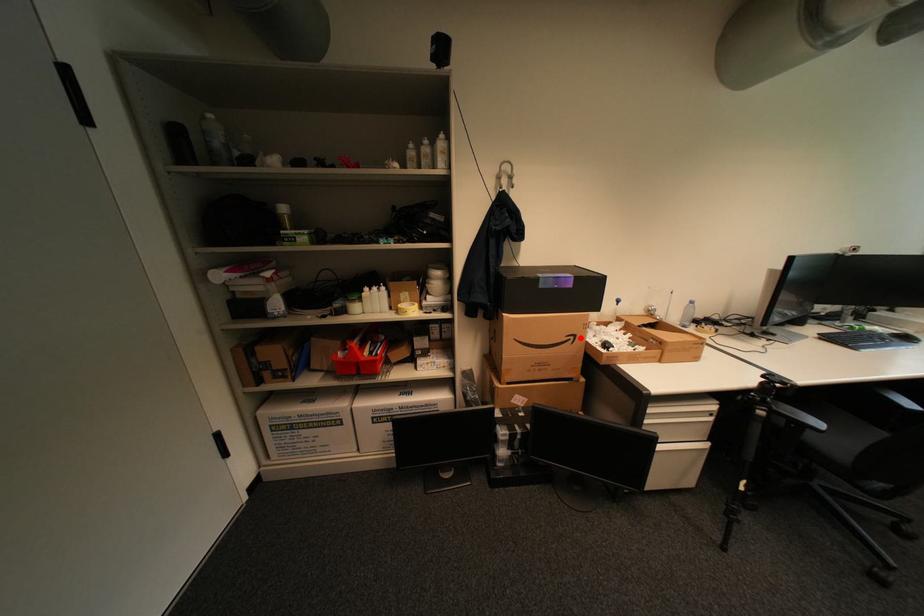
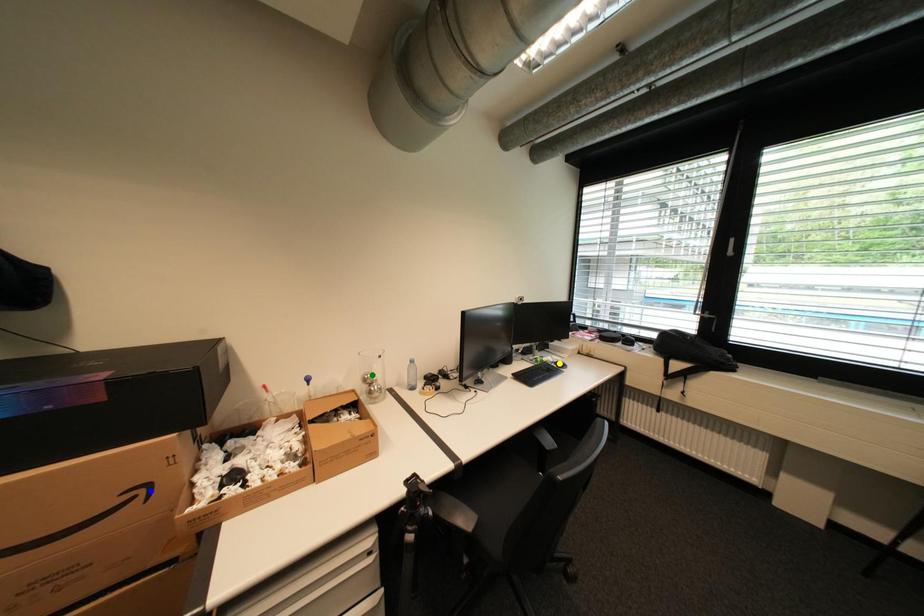
Question: I am providing you with two images of the same scene from different viewpoints. A red point is marked on the first image. You are given multiple points on the second image. Can you choose the point in image 2 that corresponds to the point in image 1?

Choices:
 (A) yellow point
 (B) green point
 (C) blue point

Answer: (C)